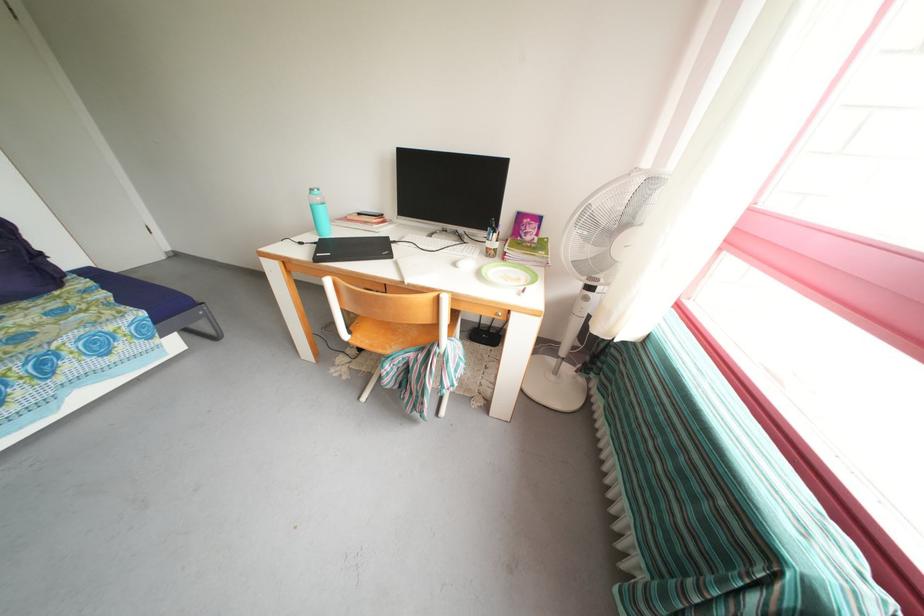
Find where to press the fan control button. Please return your answer as a coordinate pair (x, y).

(586, 297)